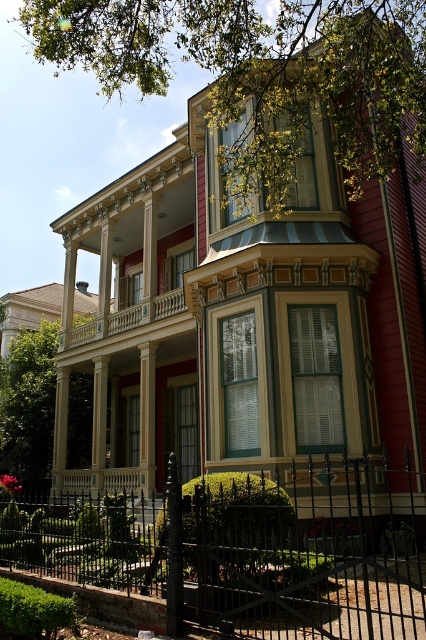
You are a painter who needs to determine which object requires a ladder to paint. Based on the scene description, which one is taller, the black wrought iron fence at center or the smooth cream railing at upper center?

The black wrought iron fence at center is taller than the smooth cream railing at upper center, so the painter would need a ladder to paint the black wrought iron fence at center.

You are standing on the porch of the historic house and want to walk towards the two points marked in the image. Which point, point (350, 620) or point (183, 298), is closer to you as you face the house?

Point (350, 620) is closer to you because it is in front of point (183, 298).

Based on the photo, you are a painter hired to paint the black wrought iron fence at center and the smooth cream railing at upper center. You have limited paint and want to know which object requires more paint. Based on the scene, which object would need more paint?

The black wrought iron fence at center requires more paint because its width is greater than the smooth cream railing at upper center.